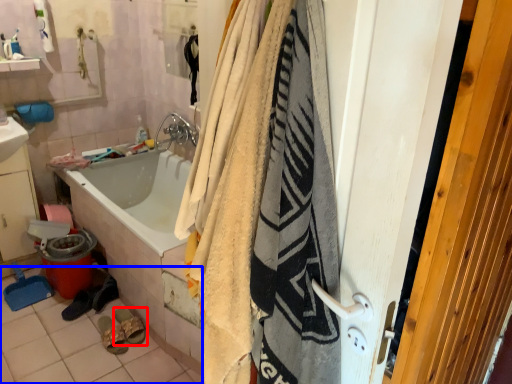
Question: Which object is closer to the camera taking this photo, footwear (highlighted by a red box) or tile (highlighted by a blue box)?

Choices:
 (A) footwear
 (B) tile

Answer: (B)